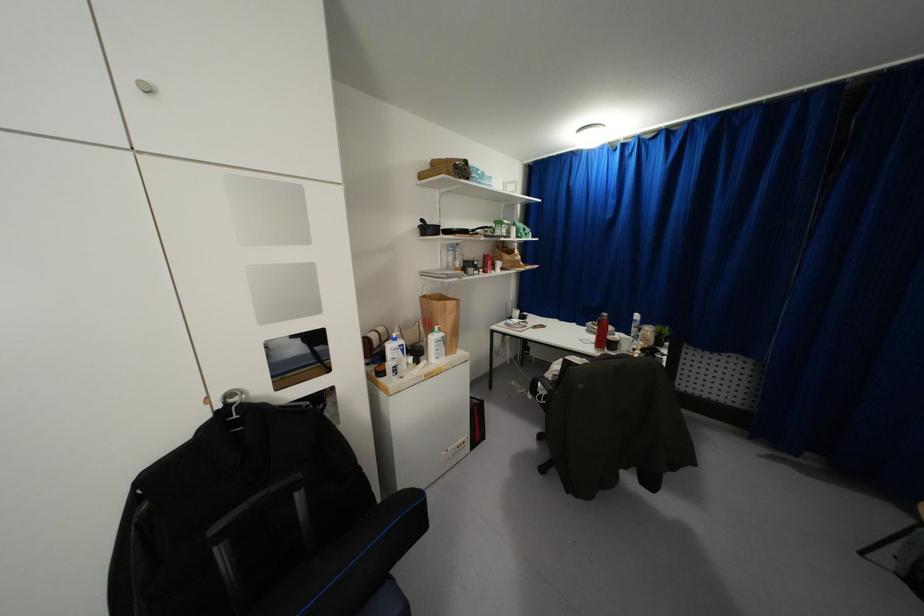
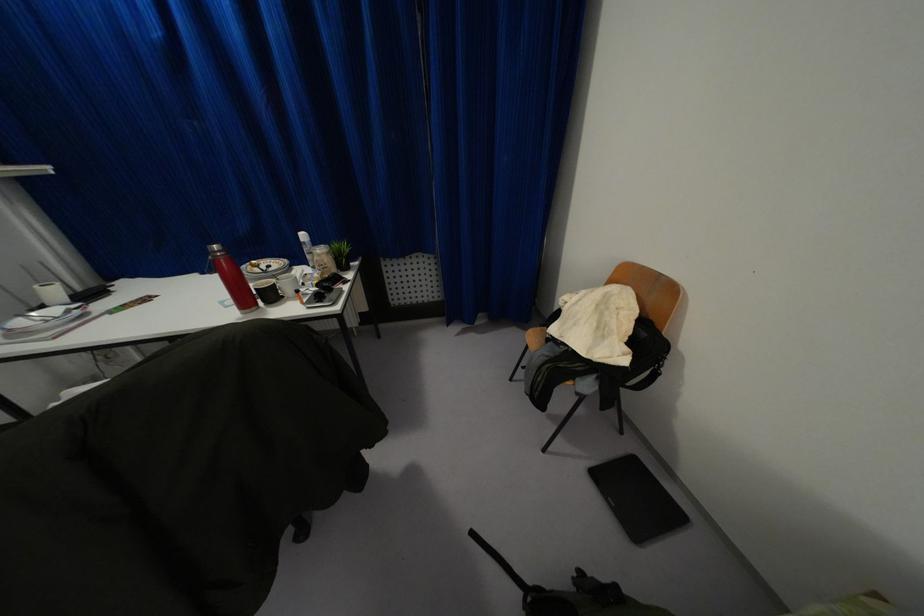
Where in the second image is the point corresponding to pixel 516 312 from the first image?

(53, 291)